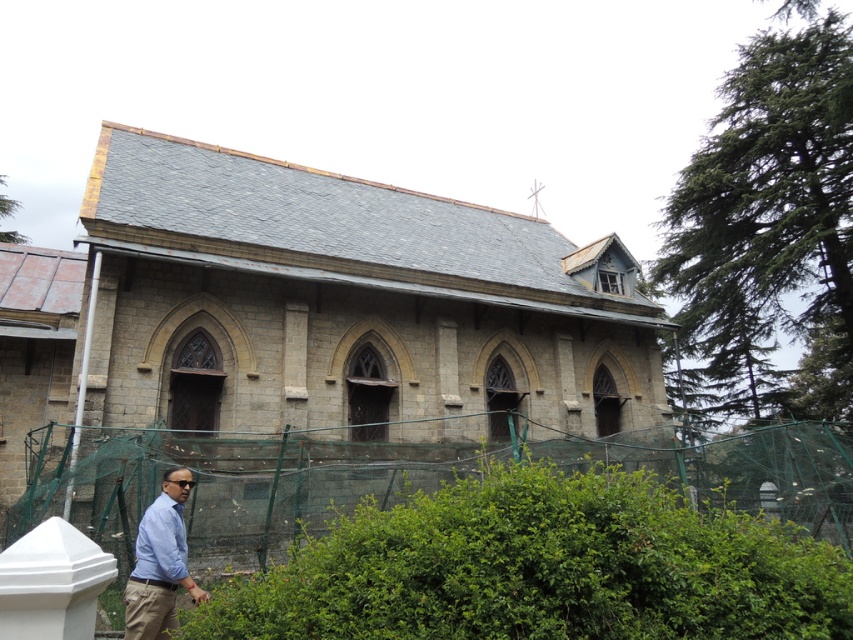
Does light blue shirt at lower left have a larger size compared to light blue cotton shirt at lower left?

Yes, light blue shirt at lower left is bigger than light blue cotton shirt at lower left.

Which of these two, light blue shirt at lower left or light blue cotton shirt at lower left, stands taller?

With more height is light blue shirt at lower left.

Which is behind, point (144, 570) or point (183, 532)?

Point (183, 532)

This screenshot has height=640, width=853. In order to click on light blue shirt at lower left in this screenshot , I will do `click(160, 563)`.

Identify the location of green leafy hedge at lower left. (543, 566).

In the scene shown: Is green leafy hedge at lower left to the right of light blue cotton shirt at lower left from the viewer's perspective?

Correct, you'll find green leafy hedge at lower left to the right of light blue cotton shirt at lower left.

Between point (554, 470) and point (163, 540), which one is positioned behind?

The point (554, 470) is behind.

I want to click on green leafy hedge at lower left, so click(543, 566).

Can you confirm if green leafy hedge at lower left is positioned above light blue shirt at lower left?

Correct, green leafy hedge at lower left is located above light blue shirt at lower left.

Consider the image. Who is more forward, (625, 538) or (154, 500)?

Point (625, 538) is more forward.

Does point (524, 461) lie behind point (183, 528)?

Yes, it is.

At what (x,y) coordinates should I click in order to perform the action: click on green leafy hedge at lower left. Please return your answer as a coordinate pair (x, y). Image resolution: width=853 pixels, height=640 pixels. Looking at the image, I should click on (543, 566).